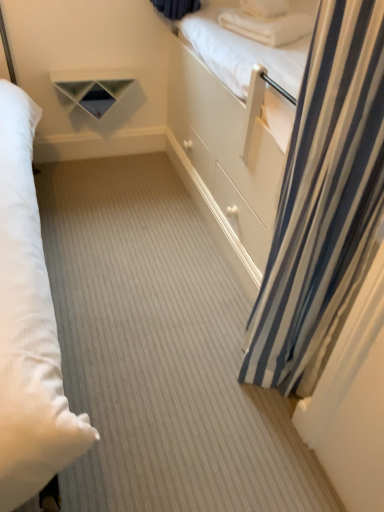
Find the location of a particular element. This screenshot has height=512, width=384. blank area beneath white matte shelf at upper center (from a real-world perspective) is located at coordinates (106, 159).